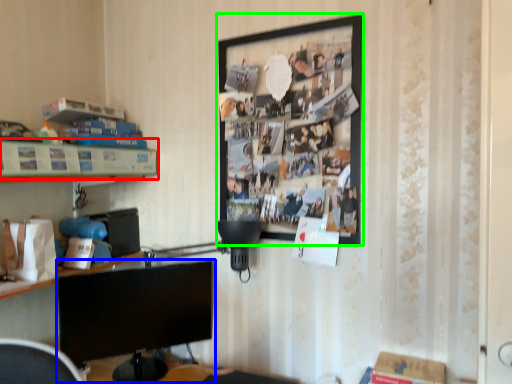
Question: Which object is positioned farthest from shelf (highlighted by a red box)? Select from computer monitor (highlighted by a blue box) and picture frame (highlighted by a green box).

Choices:
 (A) computer monitor
 (B) picture frame

Answer: (B)